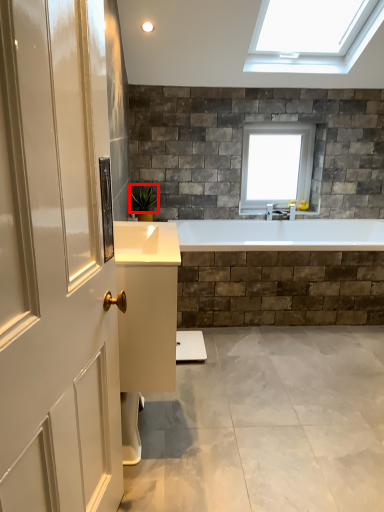
Question: From the image's perspective, where is plant (annotated by the red box) located in relation to window in the image?

Choices:
 (A) above
 (B) below

Answer: (B)